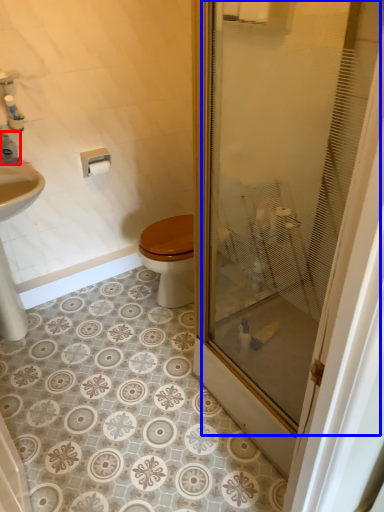
Question: Which object is further to the camera taking this photo, toiletry (highlighted by a red box) or glass door (highlighted by a blue box)?

Choices:
 (A) toiletry
 (B) glass door

Answer: (A)